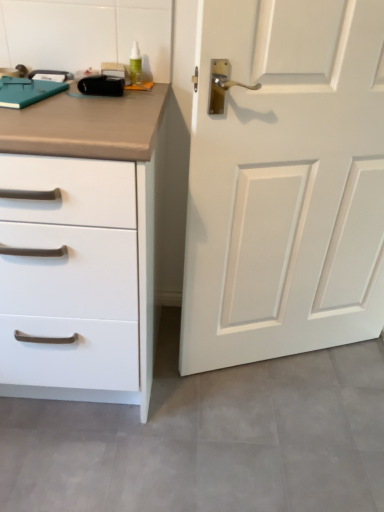
The image size is (384, 512). I want to click on vacant area that lies to the right of white matte chest of drawers at left, so click(234, 420).